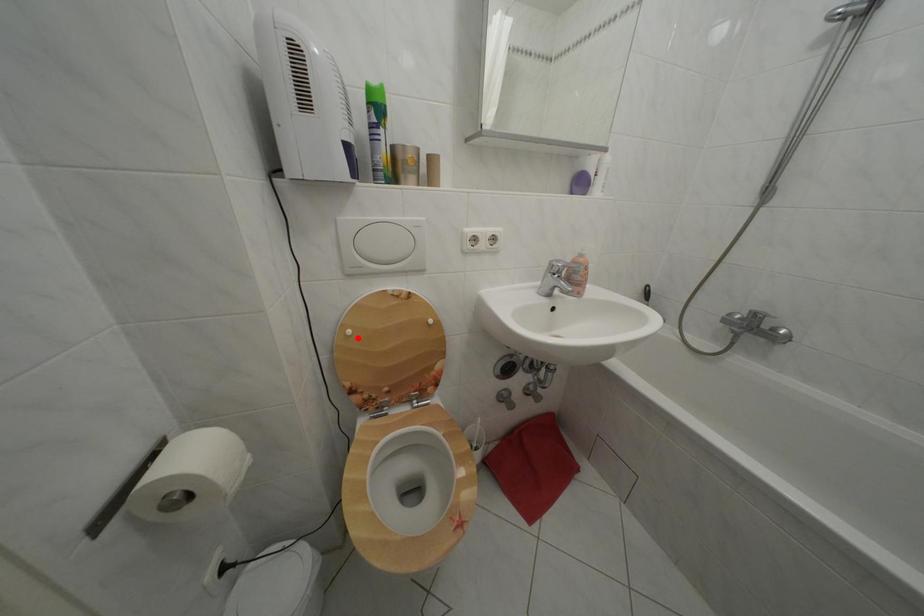
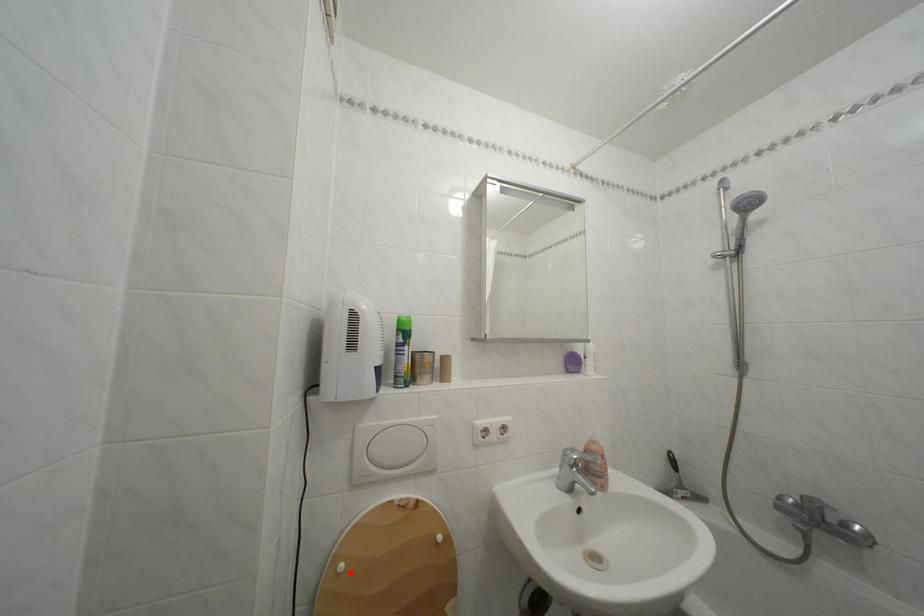
I am providing you with two images of the same scene from different viewpoints. A red point is marked on the first image and another point is marked on the second image. Are the points marked in image1 and image2 representing the same 3D position?

Yes